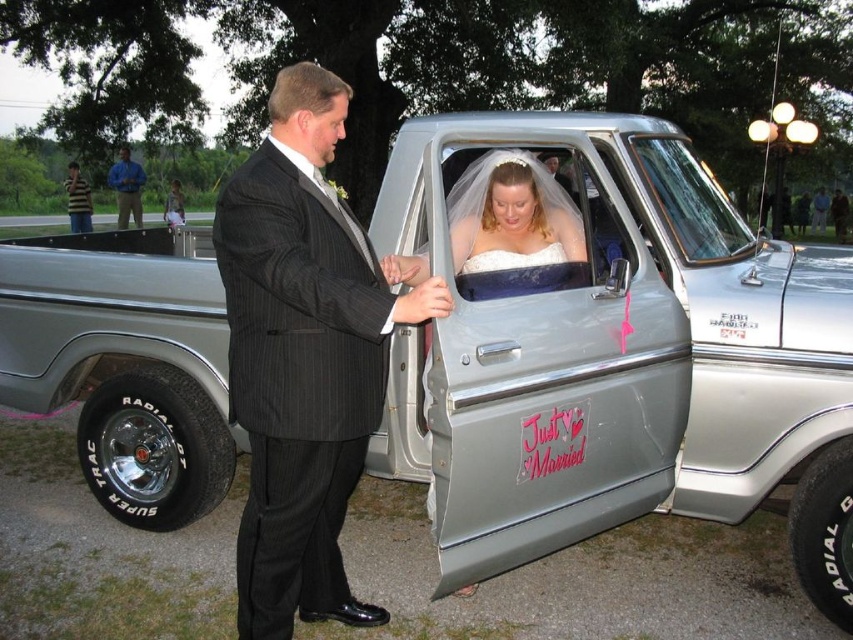
You are a photographer at the wedding and want to focus on both the black pinstripe suit at center and the white satin dress at center. Which one is positioned closer to the camera?

The black pinstripe suit at center is closer to the viewer than the white satin dress at center, so the photographer should focus on the black pinstripe suit at center first as it is nearer to the camera.

You are a photographer at the wedding. You need to adjust the lighting so that both the black pinstripe suit at center and the striped shirt at left are well lit. Which one is lower and needs more light directed downward?

The black pinstripe suit at center is located below the striped shirt at left, so you should direct more light downward towards the black pinstripe suit at center.

You are a photographer at the wedding and want to ensure both the black pinstripe suit at center and the striped shirt at left are visible in the photo. Based on their widths, which one should you focus on to ensure the entire outfit is captured without cropping?

The black pinstripe suit at center has a lesser width compared to striped shirt at left, so you should focus on capturing the striped shirt at left as it is wider and requires more space in the frame.